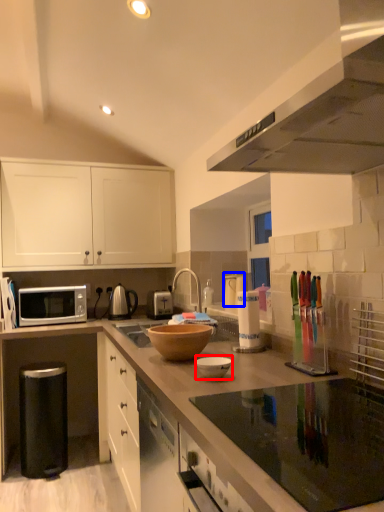
Question: Among these objects, which one is nearest to the camera, bowl (highlighted by a red box) or appliance (highlighted by a blue box)?

Choices:
 (A) bowl
 (B) appliance

Answer: (A)